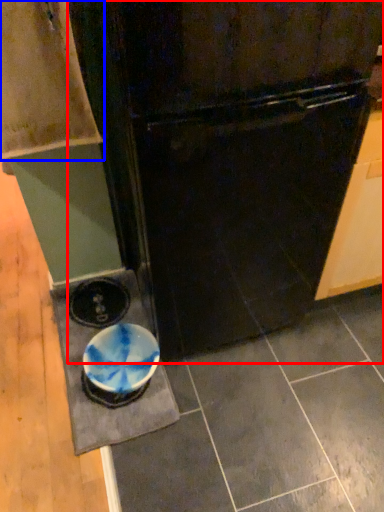
Question: Which object appears farthest to the camera in this image, refrigerator (highlighted by a red box) or cabinetry (highlighted by a blue box)?

Choices:
 (A) refrigerator
 (B) cabinetry

Answer: (B)